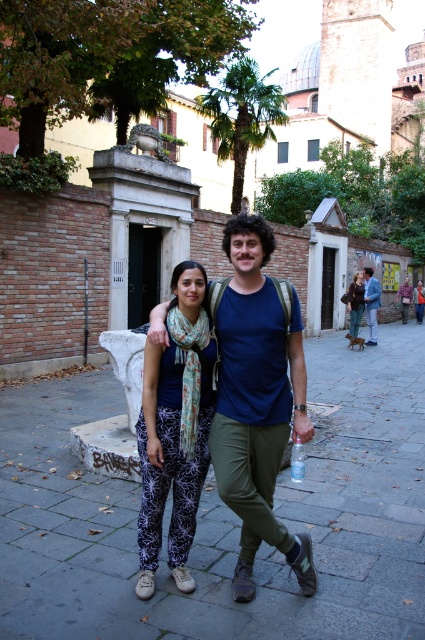
Measure the distance between matte blue shirt at center and transparent plastic bottle at center.

matte blue shirt at center is 12.06 meters away from transparent plastic bottle at center.

Is matte blue shirt at center bigger than transparent plastic bottle at center?

Yes, matte blue shirt at center is bigger than transparent plastic bottle at center.

At what (x,y) coordinates should I click in order to perform the action: click on matte blue shirt at center. Please return your answer as a coordinate pair (x, y). Image resolution: width=425 pixels, height=640 pixels. Looking at the image, I should click on (371, 301).

Identify the location of matte blue shirt at center. The width and height of the screenshot is (425, 640). (371, 301).

Can you confirm if gray concrete pavement at center is smaller than leather jacket at center?

No, gray concrete pavement at center is not smaller than leather jacket at center.

Is gray concrete pavement at center further to camera compared to leather jacket at center?

No.

Image resolution: width=425 pixels, height=640 pixels. What are the coordinates of `gray concrete pavement at center` in the screenshot? It's located at (223, 516).

Is printed fabric pants at center thinner than matte blue shirt at center?

Correct, printed fabric pants at center's width is less than matte blue shirt at center's.

Does point (169, 528) come closer to viewer compared to point (376, 333)?

That is True.

Who is more forward, (181, 566) or (376, 324)?

Point (181, 566)

Find the location of a particular element. The image size is (425, 640). printed fabric pants at center is located at coordinates tap(175, 428).